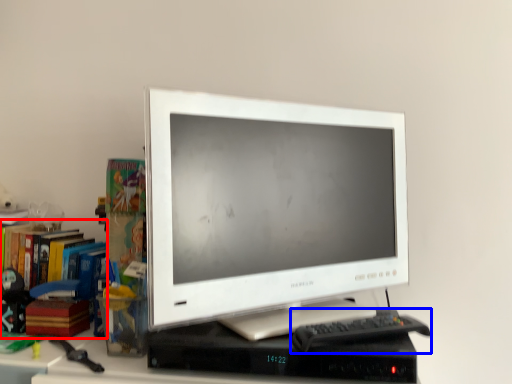
Question: Which object is closer to the camera taking this photo, bookcase (highlighted by a red box) or keyboard (highlighted by a blue box)?

Choices:
 (A) bookcase
 (B) keyboard

Answer: (B)